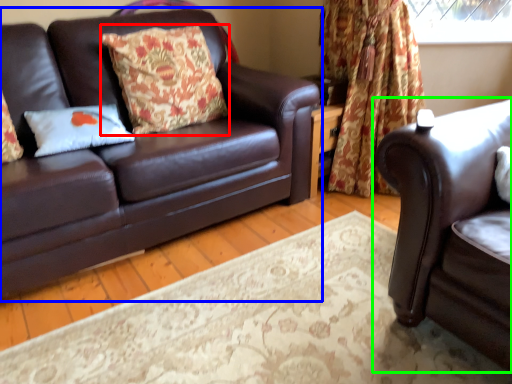
Question: Estimate the real-world distances between objects in this image. Which object is closer to pillow (highlighted by a red box), studio couch (highlighted by a blue box) or studio couch (highlighted by a green box)?

Choices:
 (A) studio couch
 (B) studio couch

Answer: (A)